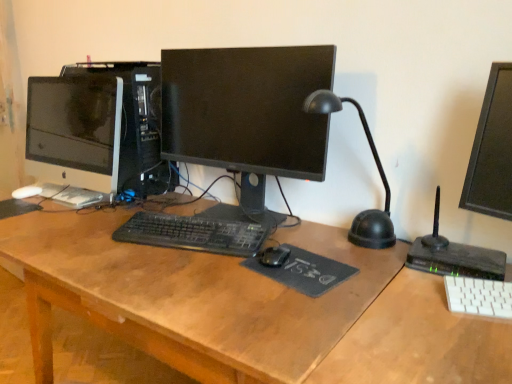
You are a GUI agent. You are given a task and a screenshot of the screen. Output one action in this format:
    pyautogui.click(x=<x>, y=<y>)
    Task: Click on the free area below black fabric mousepad at center, which appears as the 1th mousepad when viewed from the front (from a real-world perspective)
    Image resolution: width=512 pixels, height=384 pixels.
    Given the screenshot: What is the action you would take?
    pyautogui.click(x=305, y=272)